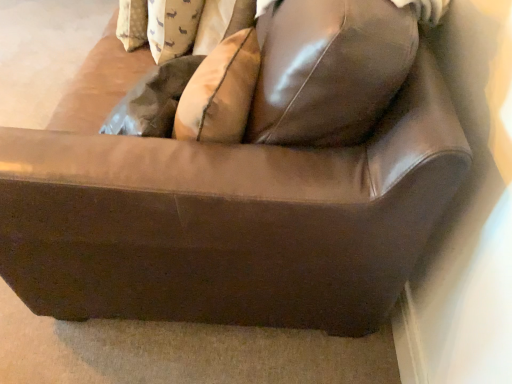
The width and height of the screenshot is (512, 384). What do you see at coordinates (329, 70) in the screenshot?
I see `glossy leather pillow at upper center` at bounding box center [329, 70].

Locate an element on the screen. The width and height of the screenshot is (512, 384). glossy leather pillow at upper center is located at coordinates (329, 70).

The image size is (512, 384). I want to click on glossy leather pillow at upper center, so click(329, 70).